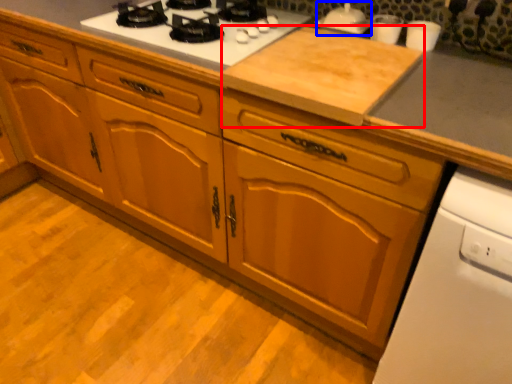
Question: Which of the following is the closest to the observer, plywood (highlighted by a red box) or appliance (highlighted by a blue box)?

Choices:
 (A) plywood
 (B) appliance

Answer: (A)